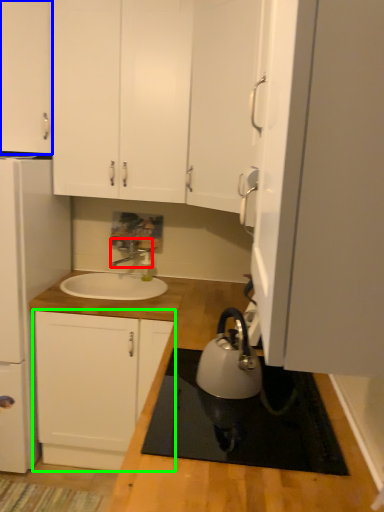
Question: Based on their relative distances, which object is nearer to tap (highlighted by a red box)? Choose from cabinetry (highlighted by a blue box) and cabinetry (highlighted by a green box).

Choices:
 (A) cabinetry
 (B) cabinetry

Answer: (B)